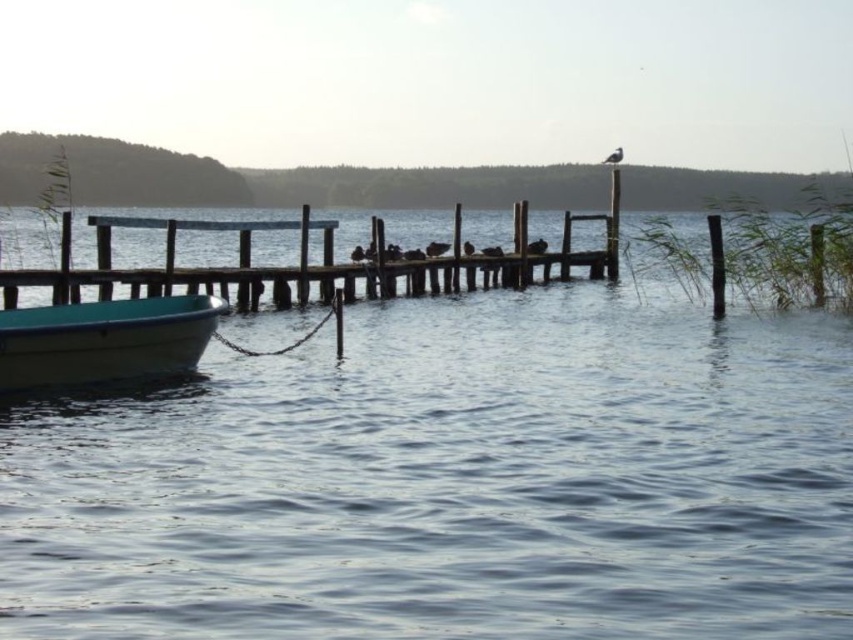
Question: Is clear blue water at center behind white plastic boat at lower left?

Choices:
 (A) no
 (B) yes

Answer: (A)

Question: Which point is farther from the camera taking this photo?

Choices:
 (A) (73, 310)
 (B) (532, 628)

Answer: (A)

Question: Which point is farther from the camera taking this photo?

Choices:
 (A) (643, 624)
 (B) (161, 355)

Answer: (B)

Question: Which point is closer to the camera?

Choices:
 (A) coord(508,440)
 (B) coord(178,316)

Answer: (A)

Question: Where is clear blue water at center located in relation to white plastic boat at lower left in the image?

Choices:
 (A) right
 (B) left

Answer: (A)

Question: Observing the image, what is the correct spatial positioning of clear blue water at center in reference to white plastic boat at lower left?

Choices:
 (A) left
 (B) right

Answer: (B)